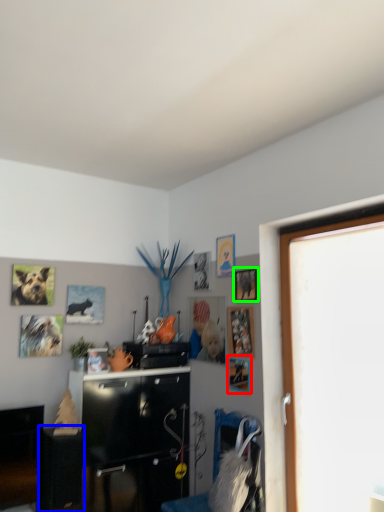
Question: Which object is positioned closest to picture frame (highlighted by a red box)? Select from table (highlighted by a blue box) and picture frame (highlighted by a green box).

Choices:
 (A) table
 (B) picture frame

Answer: (B)